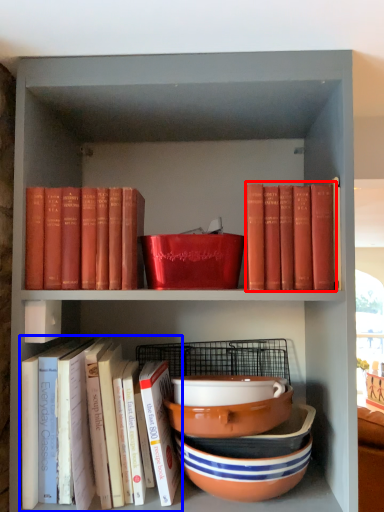
Question: Which of the following is the closest to the observer, book (highlighted by a red box) or book (highlighted by a blue box)?

Choices:
 (A) book
 (B) book

Answer: (B)